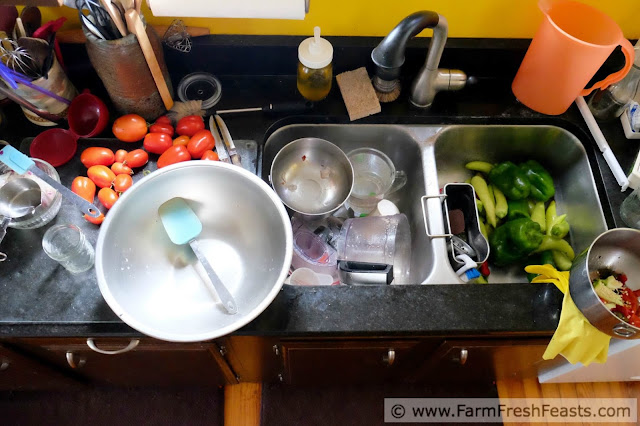
The width and height of the screenshot is (640, 426). I want to click on mixing bowl, so tap(253, 204).